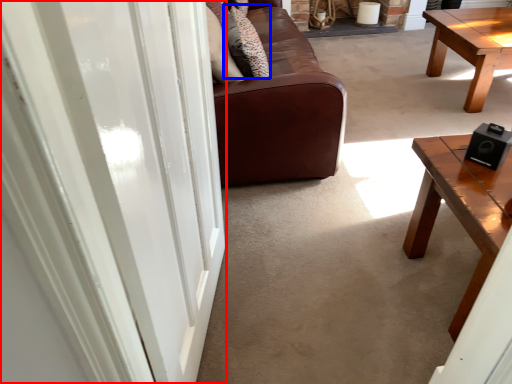
Question: Which object is closer to the camera taking this photo, screen door (highlighted by a red box) or pillow (highlighted by a blue box)?

Choices:
 (A) screen door
 (B) pillow

Answer: (A)